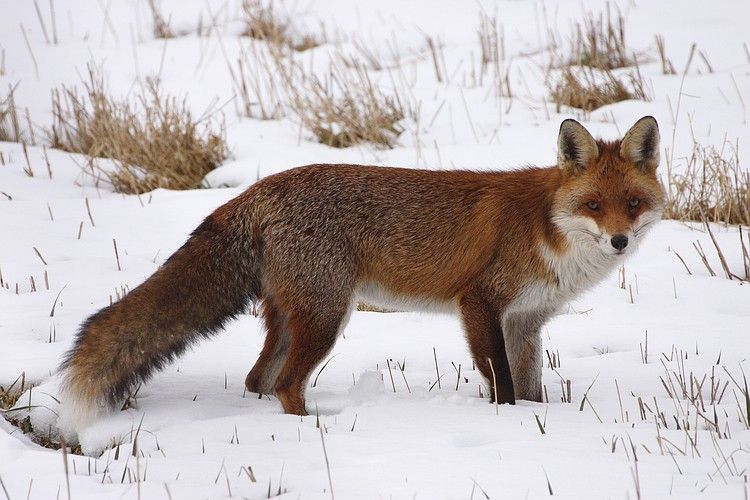
I want to click on right front leg, so click(492, 366).